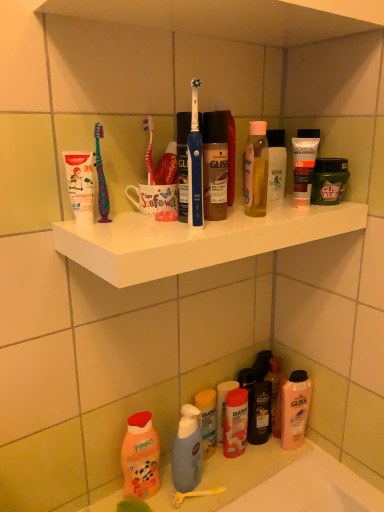
Where is `vacant area that lies in front of matte black tube at upper right, which ranks as the second toiletry in right-to-left order`? vacant area that lies in front of matte black tube at upper right, which ranks as the second toiletry in right-to-left order is located at coordinates (284, 217).